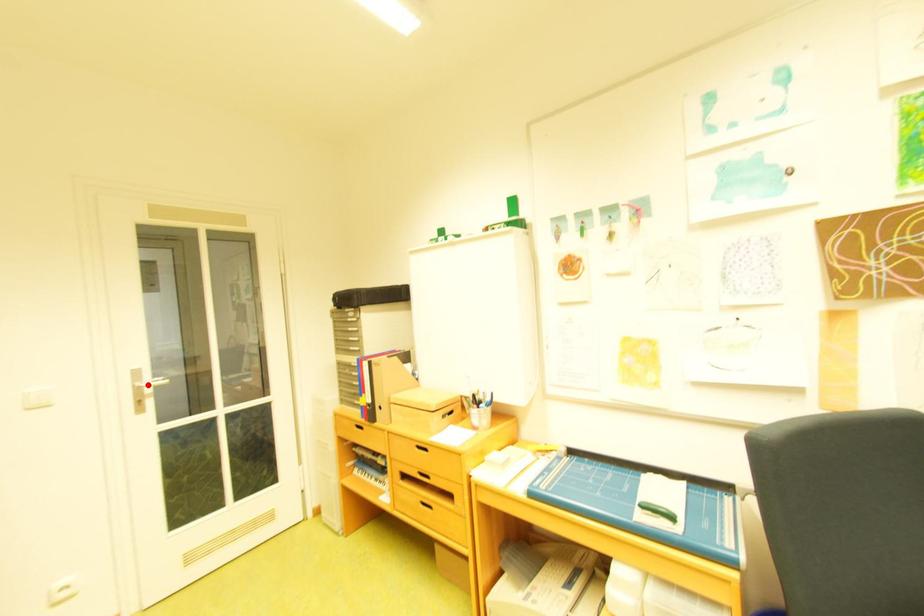
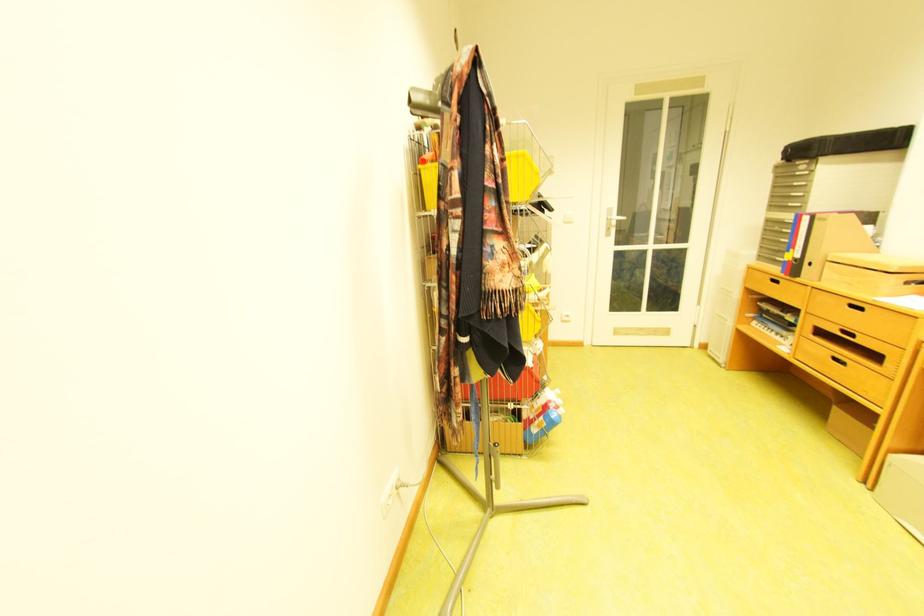
Where in the second image is the point corresponding to the highlighted location from the first image?

(621, 217)